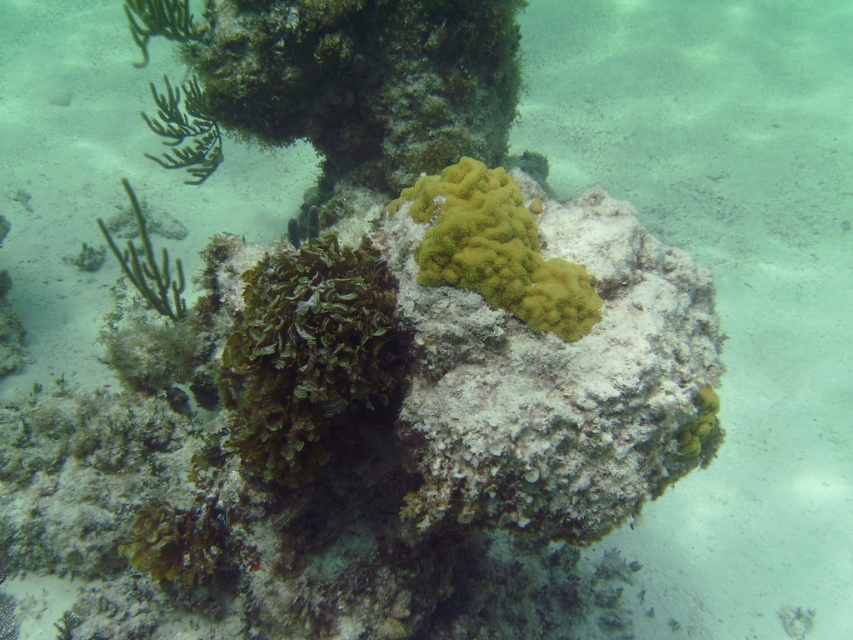
Question: Does green leafy algae at center have a smaller size compared to green matte algae at left?

Choices:
 (A) yes
 (B) no

Answer: (A)

Question: Can you confirm if green leafy algae at center is wider than yellow coral at center?

Choices:
 (A) yes
 (B) no

Answer: (B)

Question: Is green leafy algae at center positioned behind yellow coral at center?

Choices:
 (A) yes
 (B) no

Answer: (B)

Question: Which point is farther to the camera?

Choices:
 (A) (540, 272)
 (B) (372, 321)
 (C) (131, 186)

Answer: (C)

Question: Which point is closer to the camera taking this photo?

Choices:
 (A) coord(163,256)
 (B) coord(236,349)

Answer: (B)

Question: Which point is closer to the camera taking this photo?

Choices:
 (A) (589, 301)
 (B) (294, 339)
 (C) (167, 301)

Answer: (B)